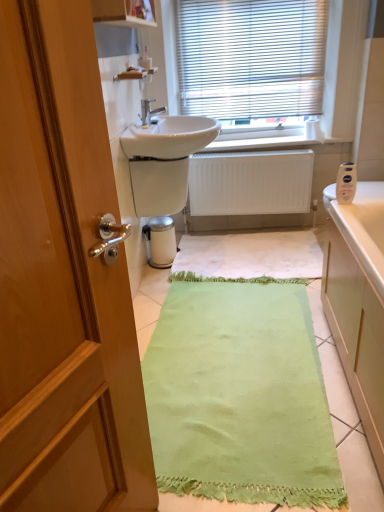
You are a GUI agent. You are given a task and a screenshot of the screen. Output one action in this format:
    pyautogui.click(x=<x>, y=<y>)
    Task: Click on the green fabric bath mat at center
    This screenshot has width=384, height=512.
    Given the screenshot: What is the action you would take?
    pyautogui.click(x=240, y=395)

Measure the distance between point (237, 453) and camera.

Point (237, 453) is 4.61 feet from camera.

I want to click on white matte toilet paper at upper right, so click(313, 130).

This screenshot has height=512, width=384. What do you see at coordinates (149, 111) in the screenshot? I see `matte silver faucet at center` at bounding box center [149, 111].

I want to click on white plastic blinds at upper center, so click(251, 58).

Could you tell me if white glossy sink at center is turned towards white matte radiator at center?

No.

Is white glossy sink at center at the left side of white matte radiator at center?

Indeed, white glossy sink at center is positioned on the left side of white matte radiator at center.

Which is in front, point (153, 169) or point (283, 173)?

Point (153, 169)

From the picture: From the image's perspective, which object appears higher, white glossy sink at center or white matte radiator at center?

white glossy sink at center.

Which of these two, green fabric bath mat at center or white matte toilet paper at upper right, is thinner?

white matte toilet paper at upper right.

Which is correct: green fabric bath mat at center is inside white matte toilet paper at upper right, or outside of it?

green fabric bath mat at center is spatially situated outside white matte toilet paper at upper right.

Is green fabric bath mat at center to the right of white matte toilet paper at upper right from the viewer's perspective?

Incorrect, green fabric bath mat at center is not on the right side of white matte toilet paper at upper right.

From a real-world perspective, is green fabric bath mat at center positioned over white matte toilet paper at upper right based on gravity?

No, from a real-world perspective, green fabric bath mat at center is not above white matte toilet paper at upper right.

Is white plastic blinds at upper center next to white matte radiator at center?

No, white plastic blinds at upper center is not next to white matte radiator at center.

Is point (238, 7) behind point (269, 187)?

No, (238, 7) is closer to viewer.

Considering the relative sizes of white plastic blinds at upper center and white matte radiator at center in the image provided, is white plastic blinds at upper center wider than white matte radiator at center?

No.

Is white plastic blinds at upper center closer to the viewer compared to white matte radiator at center?

Yes, it is in front of white matte radiator at center.

Is the position of matte silver faucet at center less distant than that of white matte toilet paper at upper right?

Yes, it is in front of white matte toilet paper at upper right.

Does matte silver faucet at center turn towards white matte toilet paper at upper right?

No, matte silver faucet at center is not aimed at white matte toilet paper at upper right.

In the scene shown: From a real-world perspective, which is physically below, matte silver faucet at center or white matte toilet paper at upper right?

white matte toilet paper at upper right, from a real-world perspective.

Would you say matte silver faucet at center is inside or outside white matte toilet paper at upper right?

The correct answer is: outside.

Which object is positioned more to the right, green fabric bath mat at center or white glossy sink at center?

green fabric bath mat at center.

Considering their positions, is green fabric bath mat at center located in front of or behind white glossy sink at center?

Visually, green fabric bath mat at center is located in front of white glossy sink at center.

Find the location of `bath mat in front of the white glossy sink at center`. bath mat in front of the white glossy sink at center is located at coordinates (240, 395).

Could you tell me if green fabric bath mat at center is turned towards white glossy sink at center?

No, green fabric bath mat at center is not facing towards white glossy sink at center.

Are white matte radiator at center and green fabric bath mat at center beside each other?

No, white matte radiator at center is not in contact with green fabric bath mat at center.

Is white matte radiator at center located outside green fabric bath mat at center?

Indeed, white matte radiator at center is completely outside green fabric bath mat at center.

From a real-world perspective, relative to green fabric bath mat at center, is white matte radiator at center vertically above or below?

In terms of real-world spatial position, white matte radiator at center is above green fabric bath mat at center.

How much distance is there between matte silver faucet at center and white plastic lotion at upper right?

A distance of 3.77 feet exists between matte silver faucet at center and white plastic lotion at upper right.

Can you confirm if matte silver faucet at center is bigger than white plastic lotion at upper right?

Yes, matte silver faucet at center is bigger than white plastic lotion at upper right.

Considering the sizes of objects matte silver faucet at center and white plastic lotion at upper right in the image provided, who is thinner, matte silver faucet at center or white plastic lotion at upper right?

With smaller width is white plastic lotion at upper right.

Identify the location of appliance in front of the matte silver faucet at center. The height and width of the screenshot is (512, 384). (346, 183).

In the image, there is a white glossy sink at center. Where is `radiator below it (from the image's perspective)`? The width and height of the screenshot is (384, 512). radiator below it (from the image's perspective) is located at coordinates (250, 183).

Image resolution: width=384 pixels, height=512 pixels. Identify the location of bath mat on the left of the white matte toilet paper at upper right. (240, 395).

Estimate the real-world distances between objects in this image. Which object is further from white matte toilet paper at upper right, green fabric bath mat at center or white glossy sink at center?

Based on the image, green fabric bath mat at center appears to be further to white matte toilet paper at upper right.

From the image, which object appears to be farther from white glossy sink at center, white plastic lotion at upper right or white plastic blinds at upper center?

white plastic lotion at upper right.

Based on their spatial positions, is white matte toilet paper at upper right or matte silver faucet at center closer to white glossy sink at center?

Based on the image, matte silver faucet at center appears to be nearer to white glossy sink at center.

Which object lies further to the anchor point matte silver faucet at center, white matte radiator at center or white plastic blinds at upper center?

Among the two, white matte radiator at center is located further to matte silver faucet at center.

Estimate the real-world distances between objects in this image. Which object is further from white matte toilet paper at upper right, white matte radiator at center or white plastic blinds at upper center?

white plastic blinds at upper center lies further to white matte toilet paper at upper right than the other object.

From the image, which object appears to be nearer to white plastic lotion at upper right, matte silver faucet at center or white plastic blinds at upper center?

Based on the image, matte silver faucet at center appears to be nearer to white plastic lotion at upper right.

Based on their spatial positions, is white matte radiator at center or matte silver faucet at center further from green fabric bath mat at center?

Among the two, matte silver faucet at center is located further to green fabric bath mat at center.

Considering their positions, is white plastic blinds at upper center positioned closer to white matte radiator at center than green fabric bath mat at center?

white plastic blinds at upper center is closer to white matte radiator at center.

You are a GUI agent. You are given a task and a screenshot of the screen. Output one action in this format:
    pyautogui.click(x=<x>, y=<y>)
    Task: Click on the sink between matte silver faucet at center and green fabric bath mat at center vertically
    
    Given the screenshot: What is the action you would take?
    (164, 161)

The image size is (384, 512). In order to click on tap between white plastic blinds at upper center and white plastic lotion at upper right vertically in this screenshot , I will do `click(149, 111)`.

At what (x,y) coordinates should I click in order to perform the action: click on toilet paper between white plastic blinds at upper center and white matte radiator at center from top to bottom. Please return your answer as a coordinate pair (x, y). This screenshot has height=512, width=384. Looking at the image, I should click on (313, 130).

At what (x,y) coordinates should I click in order to perform the action: click on sink between white plastic lotion at upper right and white matte toilet paper at upper right in the front-back direction. Please return your answer as a coordinate pair (x, y). The image size is (384, 512). Looking at the image, I should click on (164, 161).